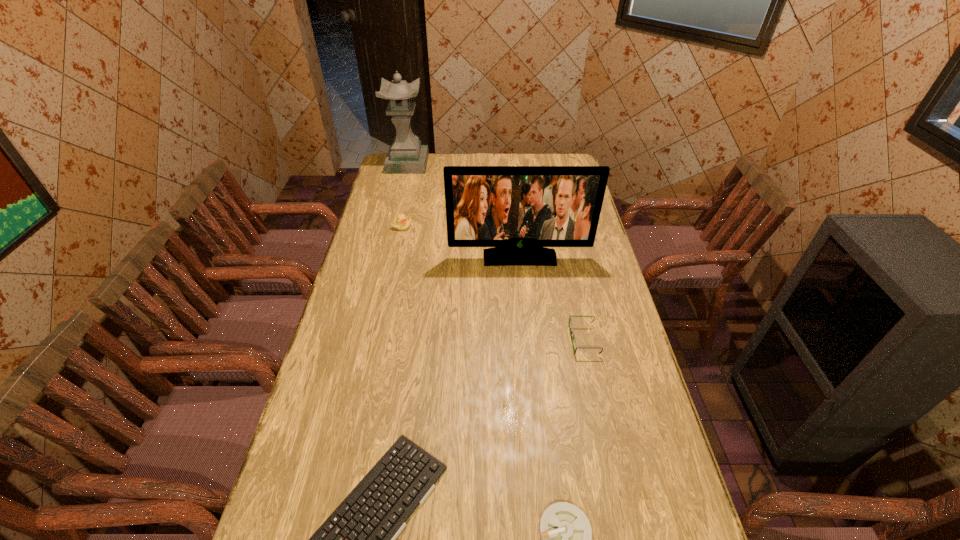
At what (x,y) coordinates should I click in order to perform the action: click on free space at the left edge. Please return your answer as a coordinate pair (x, y). Looking at the image, I should click on (343, 339).

You are a GUI agent. You are given a task and a screenshot of the screen. Output one action in this format:
    pyautogui.click(x=<x>, y=<y>)
    Task: Click on the vacant area at the right edge
    
    Given the screenshot: What is the action you would take?
    pyautogui.click(x=638, y=386)

In the image, there is a desktop. Where is `blank space at the far right corner`? This screenshot has height=540, width=960. blank space at the far right corner is located at coordinates (555, 158).

I want to click on empty space that is in between the duckling and the farthest object, so click(x=405, y=195).

Locate an element on the screen. the closest object to the fourth shortest object is located at coordinates (518, 210).

Find the location of a particular element. The height and width of the screenshot is (540, 960). object that stands as the fourth closest to the fifth nearest object is located at coordinates (358, 539).